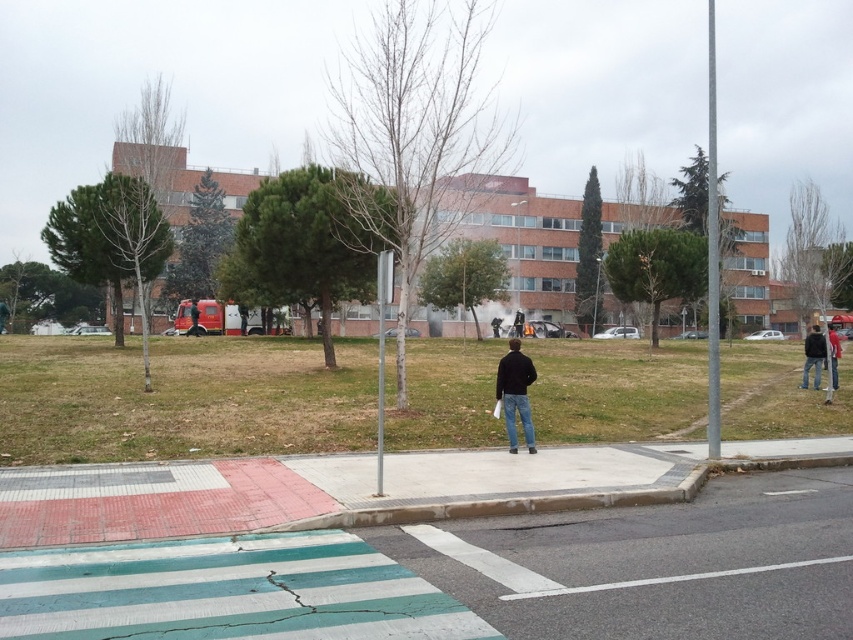
Question: Is dark blue jeans at center positioned in front of dark blue jeans at lower right?

Choices:
 (A) no
 (B) yes

Answer: (B)

Question: Which of these objects is positioned closest to the dark blue jeans at right?

Choices:
 (A) dark blue jeans at center
 (B) dark blue jeans at lower right

Answer: (B)

Question: Does dark blue jeans at center appear on the right side of dark blue jeans at right?

Choices:
 (A) no
 (B) yes

Answer: (A)

Question: From the image, what is the correct spatial relationship of dark blue jeans at center in relation to dark blue jeans at lower right?

Choices:
 (A) left
 (B) right

Answer: (A)

Question: Which object appears closest to the camera in this image?

Choices:
 (A) dark blue jeans at lower right
 (B) dark blue jeans at right

Answer: (B)

Question: Which object is closer to the camera taking this photo?

Choices:
 (A) dark blue jeans at lower right
 (B) dark blue jeans at right

Answer: (B)